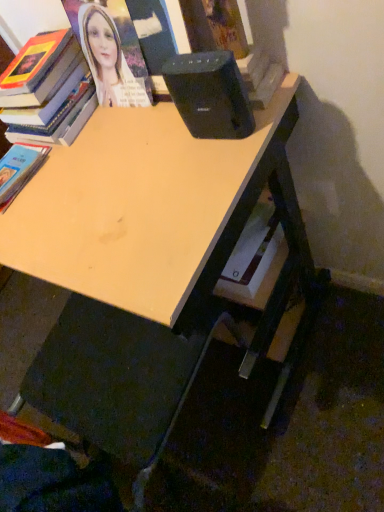
Question: Does hardcover book at lower left, marked as the second book in a top-to-bottom arrangement, come in front of hardcover book at upper left, which is the 2th book in bottom-to-top order?

Choices:
 (A) yes
 (B) no

Answer: (B)

Question: Is hardcover book at upper left, which is the 2th book in bottom-to-top order, a part of hardcover book at lower left, acting as the 1th book starting from the bottom?

Choices:
 (A) yes
 (B) no

Answer: (B)

Question: Is the position of hardcover book at lower left, marked as the second book in a top-to-bottom arrangement, more distant than that of hardcover book at upper left, which is the 2th book in bottom-to-top order?

Choices:
 (A) yes
 (B) no

Answer: (A)

Question: Would you consider hardcover book at lower left, acting as the 1th book starting from the bottom, to be distant from hardcover book at upper left, which is the first book from top to bottom?

Choices:
 (A) yes
 (B) no

Answer: (B)

Question: Is hardcover book at lower left, acting as the 1th book starting from the bottom, shorter than hardcover book at upper left, which is the 2th book in bottom-to-top order?

Choices:
 (A) yes
 (B) no

Answer: (A)

Question: Does hardcover book at lower left, marked as the second book in a top-to-bottom arrangement, appear on the left side of hardcover book at upper left, which is the 2th book in bottom-to-top order?

Choices:
 (A) yes
 (B) no

Answer: (A)

Question: Is the depth of light wood desk at center greater than that of hardcover book at upper left, which is the first book from top to bottom?

Choices:
 (A) no
 (B) yes

Answer: (A)

Question: From a real-world perspective, does light wood desk at center stand above hardcover book at upper left, which is the first book from top to bottom?

Choices:
 (A) yes
 (B) no

Answer: (B)

Question: Is light wood desk at center surrounding hardcover book at upper left, which is the 2th book in bottom-to-top order?

Choices:
 (A) yes
 (B) no

Answer: (B)

Question: Is light wood desk at center smaller than hardcover book at upper left, which is the first book from top to bottom?

Choices:
 (A) no
 (B) yes

Answer: (A)

Question: Is light wood desk at center facing away from hardcover book at upper left, which is the 2th book in bottom-to-top order?

Choices:
 (A) no
 (B) yes

Answer: (A)

Question: Does light wood desk at center have a lesser width compared to hardcover book at upper left, which is the 2th book in bottom-to-top order?

Choices:
 (A) yes
 (B) no

Answer: (B)

Question: Is black plastic speaker at upper center beside hardcover book at lower left, marked as the second book in a top-to-bottom arrangement?

Choices:
 (A) yes
 (B) no

Answer: (B)